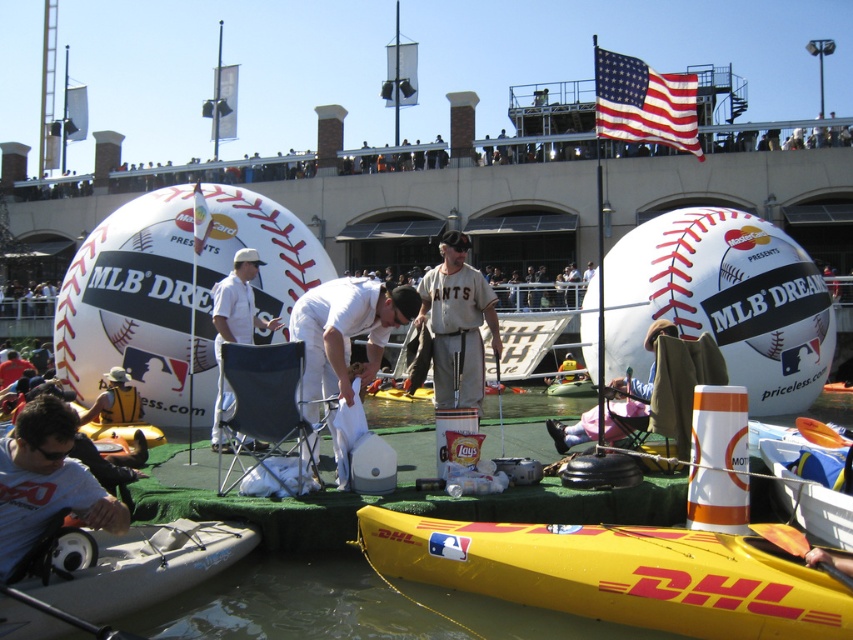
Question: Which point is closer to the camera?

Choices:
 (A) white matte baseball cap at center
 (B) gray plastic kayak at lower left
 (C) white fabric chair at center
 (D) yellow plastic paddle at center

Answer: (B)

Question: Which point appears farthest from the camera in this image?

Choices:
 (A) (836, 579)
 (B) (151, 577)
 (C) (225, 285)
 (D) (102, 492)

Answer: (C)

Question: Which of the following is the closest to the observer?

Choices:
 (A) (828, 568)
 (B) (13, 474)
 (C) (9, 593)

Answer: (C)

Question: Is gray plastic kayak at lower left positioned before white matte baseball cap at center?

Choices:
 (A) no
 (B) yes

Answer: (B)

Question: Can you confirm if white fabric chair at center is positioned below yellow rubber paddle at lower right?

Choices:
 (A) no
 (B) yes

Answer: (A)

Question: Does yellow plastic kayak at lower center have a larger size compared to gray plastic kayak at lower left?

Choices:
 (A) yes
 (B) no

Answer: (A)